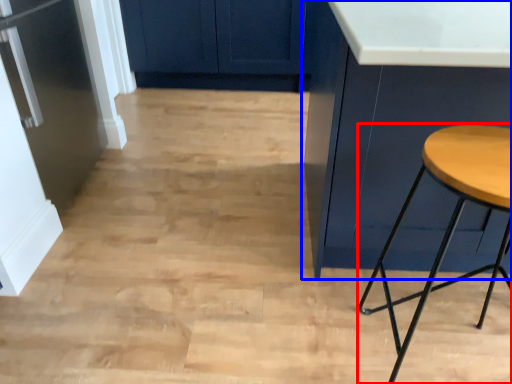
Question: Which object appears closest to the camera in this image, stool (highlighted by a red box) or cabinetry (highlighted by a blue box)?

Choices:
 (A) stool
 (B) cabinetry

Answer: (A)